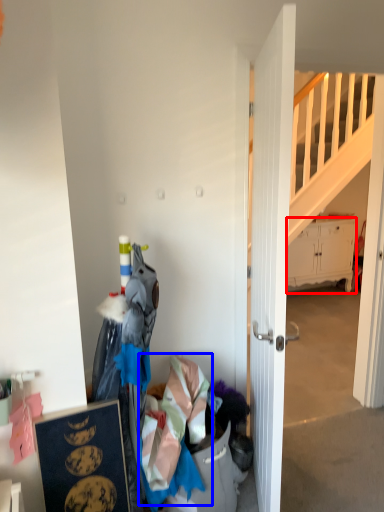
Question: Which object appears farthest to the camera in this image, cabinetry (highlighted by a red box) or clothing (highlighted by a blue box)?

Choices:
 (A) cabinetry
 (B) clothing

Answer: (A)